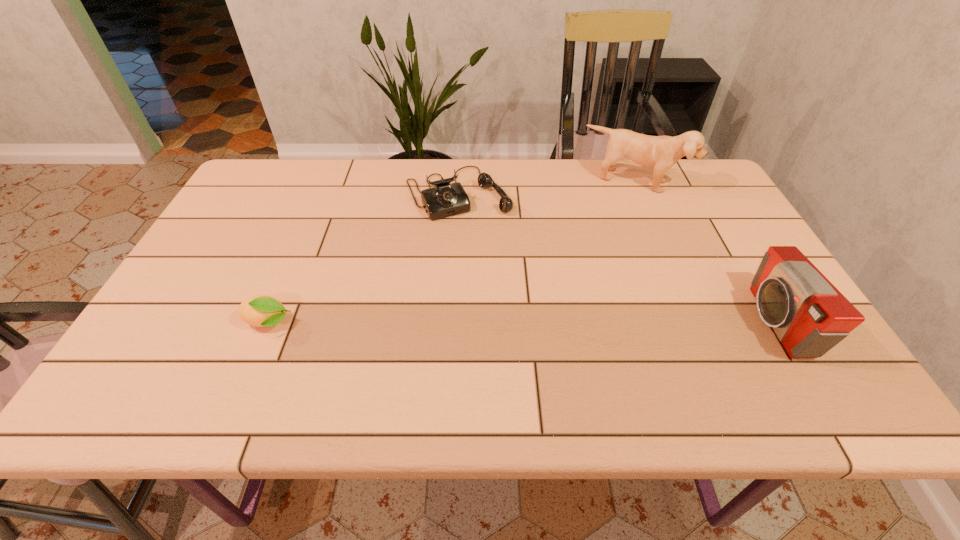
Locate an element on the screen. The width and height of the screenshot is (960, 540). free space on the desktop that is between the shortest object and the camera and is positioned on the dial of the telephone is located at coordinates (542, 322).

Where is `free space on the desktop that is between the leftmost object and the second tallest object and is positioned on the left side of the puppy`? This screenshot has width=960, height=540. free space on the desktop that is between the leftmost object and the second tallest object and is positioned on the left side of the puppy is located at coordinates (587, 322).